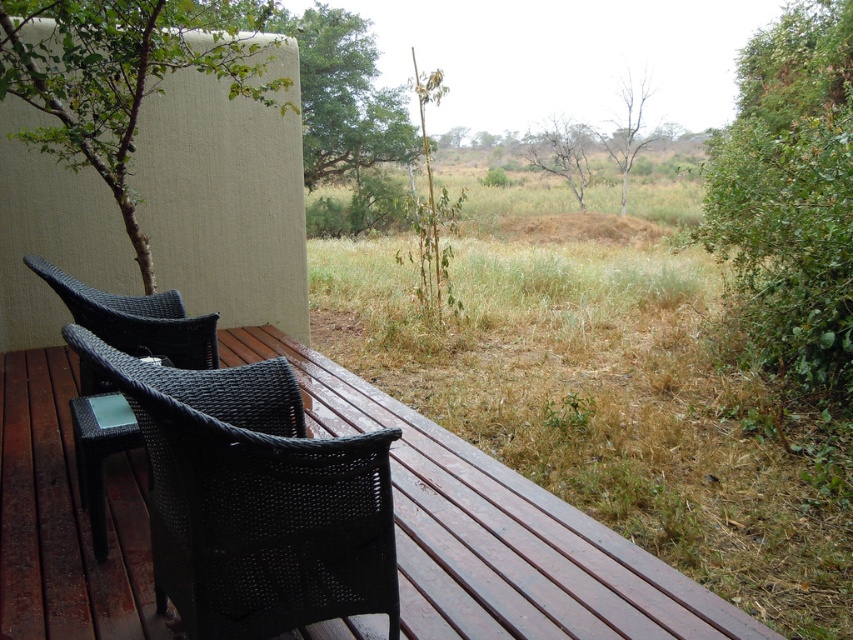
Is black wicker chair at lower left smaller than green leafy bush at right?

Yes, black wicker chair at lower left is smaller than green leafy bush at right.

Find the location of a particular element. The image size is (853, 640). black wicker chair at lower left is located at coordinates (254, 499).

Which is more to the left, brown wood deck at center or bare branches at center?

brown wood deck at center is more to the left.

Does brown wood deck at center have a lesser width compared to bare branches at center?

In fact, brown wood deck at center might be wider than bare branches at center.

The width and height of the screenshot is (853, 640). In order to click on brown wood deck at center in this screenshot , I will do `click(494, 531)`.

Does green leafy bush at right have a greater height compared to bare branches at center?

Yes.

Does green leafy bush at right have a greater width compared to bare branches at center?

Yes, green leafy bush at right is wider than bare branches at center.

At what (x,y) coordinates should I click in order to perform the action: click on green leafy bush at right. Please return your answer as a coordinate pair (x, y). Looking at the image, I should click on (790, 195).